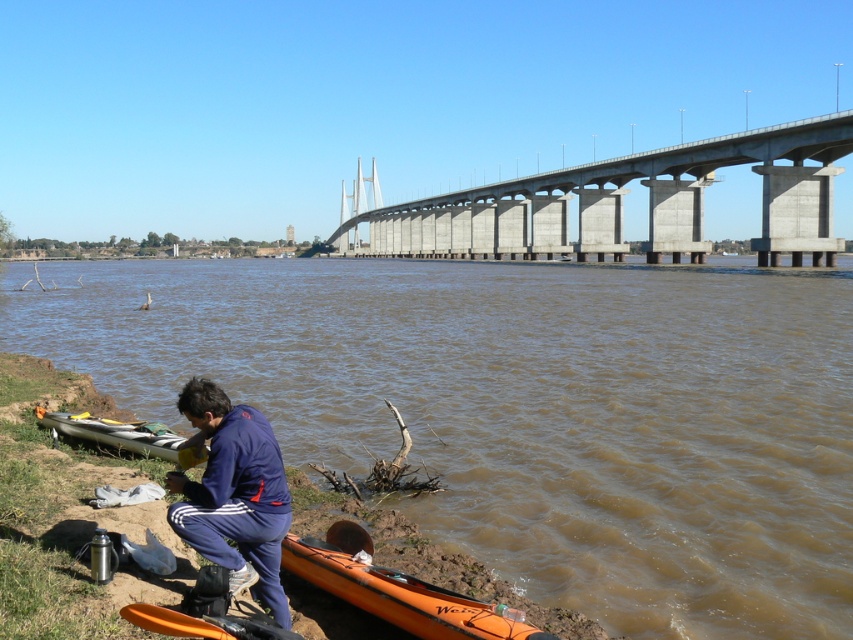
You are a delivery drone with a maximum flight range of 100 meters. You need to deliver a package from the concrete bridge at upper center to the orange plastic kayak at lower center. Can you complete the delivery without needing a recharge?

The concrete bridge at upper center and orange plastic kayak at lower center are 104.87 meters apart from each other. Since the distance exceeds the drone s 100 meter range, it cannot complete the delivery without recharging.

You are a hiker who wants to cross the river using the concrete bridge at upper center. However, you notice the blue fabric pants at lower center are blocking the path. Can you still safely cross the bridge?

The concrete bridge at upper center is above the blue fabric pants at lower center, so the bridge is elevated and the pants are not blocking the path. You can safely cross the bridge.

You are a photographer planning to take a picture of the gray matte canoe at lower left and the concrete bridge at upper center. To ensure both are in focus, you need to know which object is taller. Can you tell me which one is taller?

The concrete bridge at upper center is taller than the gray matte canoe at lower left according to the description.